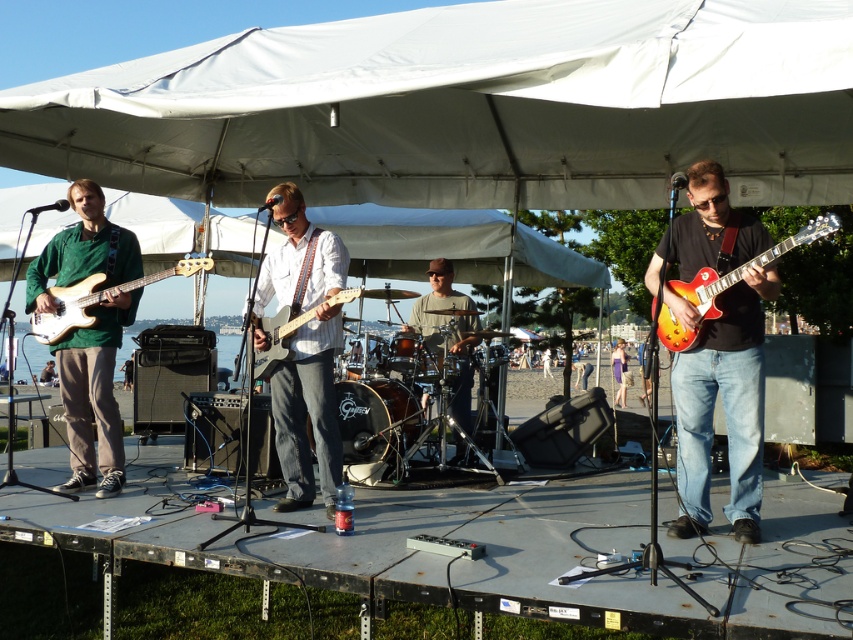
Is matte white guitar at center thinner than purple satin dress at center?

No, matte white guitar at center is not thinner than purple satin dress at center.

Is matte white guitar at center taller than purple satin dress at center?

Yes, matte white guitar at center is taller than purple satin dress at center.

Identify the location of matte white guitar at center. This screenshot has width=853, height=640. pos(305,349).

Looking at this image, does matte white guitar at center appear on the left side of matte white bass guitar at left?

Incorrect, matte white guitar at center is not on the left side of matte white bass guitar at left.

Can you confirm if matte white guitar at center is wider than matte white bass guitar at left?

In fact, matte white guitar at center might be narrower than matte white bass guitar at left.

Who is more forward, (332, 321) or (154, 273)?

Positioned in front is point (332, 321).

Locate an element on the screen. The image size is (853, 640). matte white guitar at center is located at coordinates (305, 349).

Who is positioned more to the left, matte gray electric guitar at center or purple satin dress at center?

Positioned to the left is matte gray electric guitar at center.

Looking at this image, who is higher up, matte gray electric guitar at center or purple satin dress at center?

matte gray electric guitar at center is above.

Which is in front, point (260, 368) or point (610, 356)?

Point (260, 368)

Find the location of a particular element. matte gray electric guitar at center is located at coordinates (x=277, y=339).